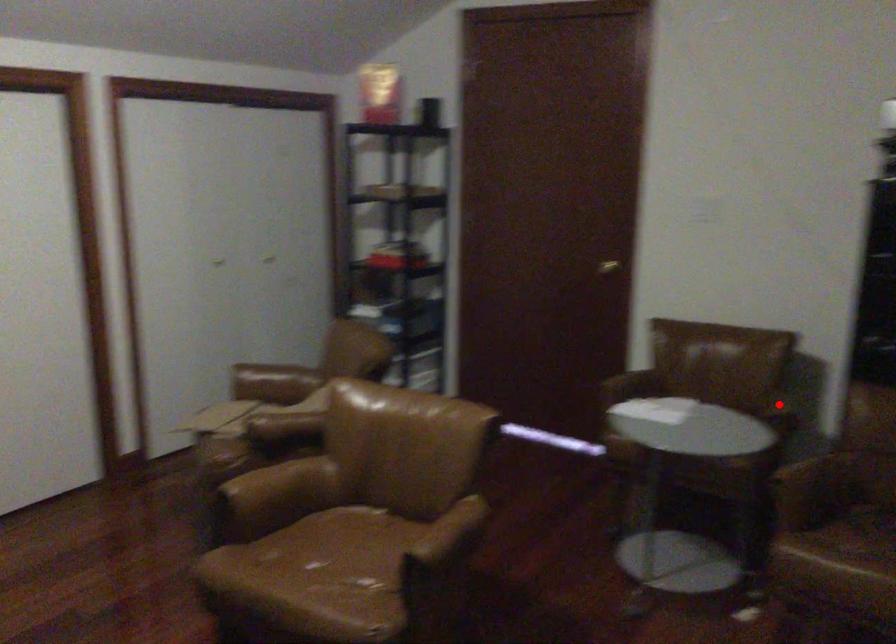
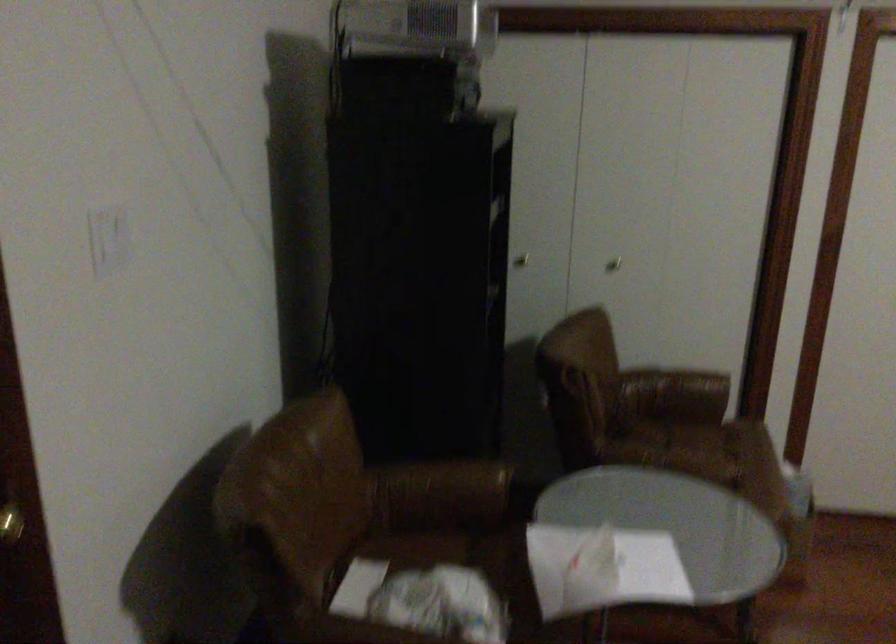
Question: I am providing you with two images of the same scene from different viewpoints. A red point is marked on the first image. Is the red point's position out of view in image 2?

Choices:
 (A) Yes
 (B) No

Answer: (B)